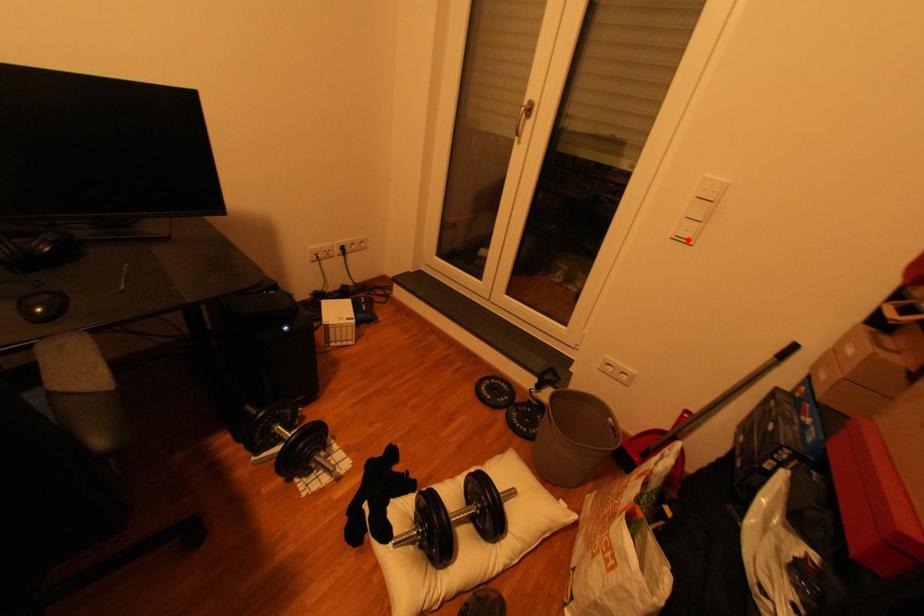
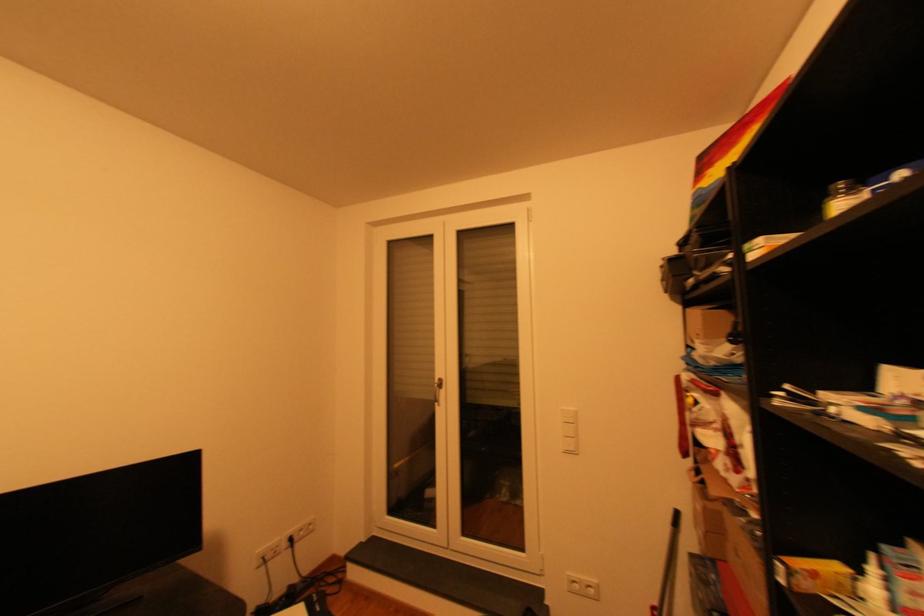
Locate, in the second image, the point that corresponds to the highlighted location in the first image.

(576, 453)